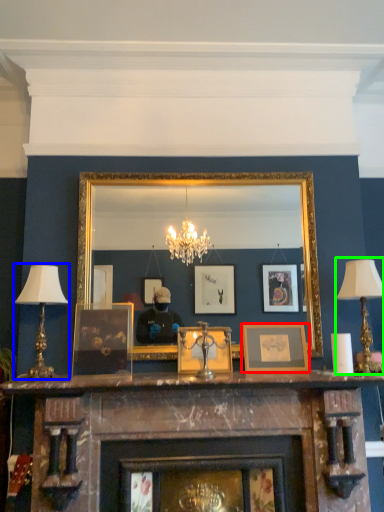
Question: Which object is positioned closest to picture frame (highlighted by a red box)? Select from table lamp (highlighted by a blue box) and table lamp (highlighted by a green box).

Choices:
 (A) table lamp
 (B) table lamp

Answer: (B)